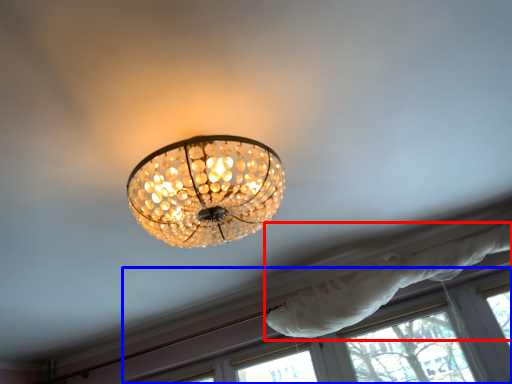
Question: Among these objects, which one is farthest to the camera, curtain (highlighted by a red box) or window (highlighted by a blue box)?

Choices:
 (A) curtain
 (B) window

Answer: (B)